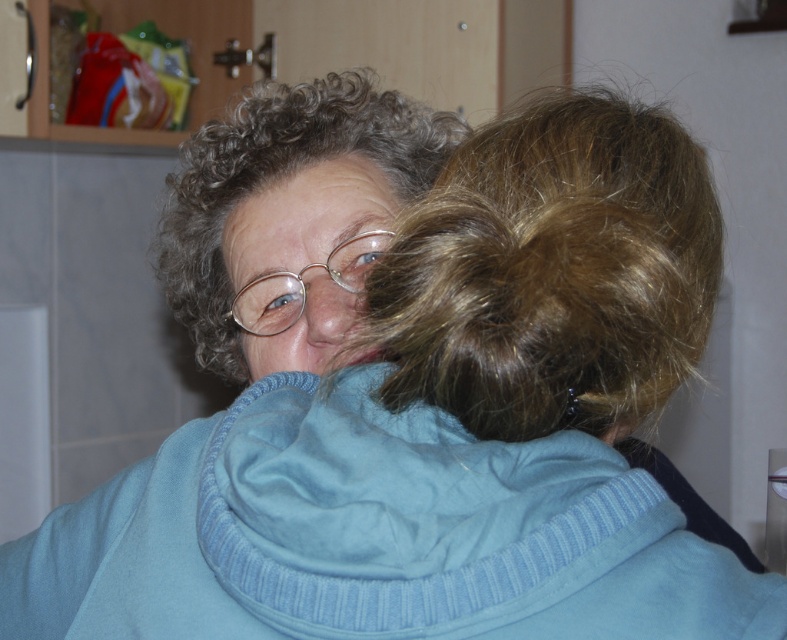
You are a photographer setting up a shoot in this kitchen scene. You need to position a small light source to illuminate the light blue fleece at center and the brown curly hair at upper center. Based on their positions, where should you place the light source relative to these objects to ensure both are well lit?

The light blue fleece at center is located below the brown curly hair at upper center. To ensure both are well lit, position the light source above and slightly in front of the brown curly hair at upper center so that it illuminates both the upper and lower areas effectively.

Based on the photo, you are a photographer setting up for a portrait in this kitchen scene. You need to ensure that the light blue fleece at center and the curly brown hair at center are both visible in the frame. Based on their heights, which object should you adjust the camera angle to focus on first to capture both?

The light blue fleece at center has a lesser height compared to curly brown hair at center, so you should adjust the camera angle to focus on the curly brown hair at center first to ensure both are visible.